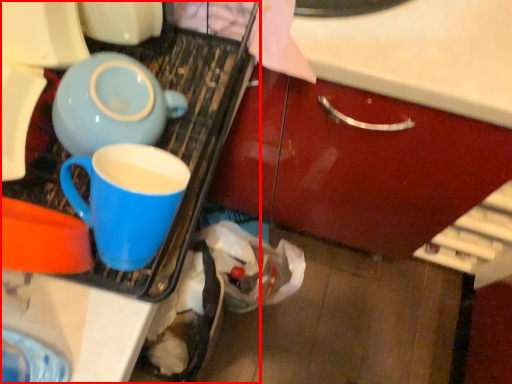
Question: From the image's perspective, what is the correct spatial relationship of appliance (annotated by the red box) in relation to coffee cup?

Choices:
 (A) above
 (B) below

Answer: (A)